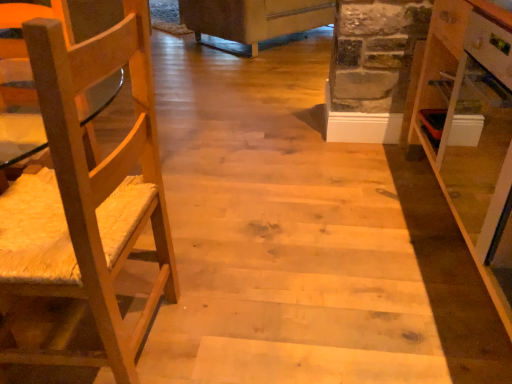
Where is `natural wood chair at left`? The width and height of the screenshot is (512, 384). natural wood chair at left is located at coordinates (89, 195).

Locate an element on the screen. white fabric couch at upper center is located at coordinates (254, 18).

Is white fabric couch at upper center to the left or to the right of natural wood chair at left in the image?

From the image, it's evident that white fabric couch at upper center is to the right of natural wood chair at left.

Is white fabric couch at upper center aimed at natural wood chair at left?

No, white fabric couch at upper center does not turn towards natural wood chair at left.

Can natural wood chair at left be found inside white fabric couch at upper center?

Definitely not — natural wood chair at left is not inside white fabric couch at upper center.

From a real-world perspective, is white fabric couch at upper center physically located above or below white glossy cabinet at right?

From a real-world perspective, white fabric couch at upper center is physically below white glossy cabinet at right.

Where is `furniture beneath the white glossy cabinet at right (from a real-world perspective)`? The image size is (512, 384). furniture beneath the white glossy cabinet at right (from a real-world perspective) is located at coordinates (254, 18).

Is point (300, 23) positioned after point (500, 33)?

Yes, point (300, 23) is farther from viewer.

Considering the sizes of objects natural wood chair at left and white glossy cabinet at right in the image provided, who is wider, natural wood chair at left or white glossy cabinet at right?

natural wood chair at left.

Consider the image. From a real-world perspective, is natural wood chair at left positioned above or below white glossy cabinet at right?

From a real-world perspective, natural wood chair at left is physically below white glossy cabinet at right.

From the image's perspective, is natural wood chair at left positioned above or below white glossy cabinet at right?

From the image's perspective, natural wood chair at left appears below white glossy cabinet at right.

Is natural wood chair at left placed right next to white glossy cabinet at right?

No, natural wood chair at left is not making contact with white glossy cabinet at right.

Is white fabric couch at upper center inside white glossy cabinet at right?

That's incorrect, white fabric couch at upper center is not inside white glossy cabinet at right.

Considering the relative sizes of white glossy cabinet at right and white fabric couch at upper center in the image provided, is white glossy cabinet at right shorter than white fabric couch at upper center?

No, white glossy cabinet at right is not shorter than white fabric couch at upper center.

From the image's perspective, is white glossy cabinet at right above or below white fabric couch at upper center?

white glossy cabinet at right is situated lower than white fabric couch at upper center in the image.

Considering the positions of points (433, 54) and (266, 26), is point (433, 54) closer to camera compared to point (266, 26)?

Yes, point (433, 54) is closer to viewer.

Are white glossy cabinet at right and natural wood chair at left far apart?

white glossy cabinet at right is positioned a significant distance from natural wood chair at left.

Considering the sizes of objects white glossy cabinet at right and natural wood chair at left in the image provided, who is bigger, white glossy cabinet at right or natural wood chair at left?

natural wood chair at left is bigger.

Where is `chair on the left of white glossy cabinet at right`? chair on the left of white glossy cabinet at right is located at coordinates [89, 195].

Could you tell me if white glossy cabinet at right is turned towards natural wood chair at left?

Yes, white glossy cabinet at right is oriented towards natural wood chair at left.

Is natural wood chair at left in contact with white fabric couch at upper center?

natural wood chair at left is not next to white fabric couch at upper center, and they're not touching.

How distant is natural wood chair at left from white fabric couch at upper center?

natural wood chair at left is 3.06 meters from white fabric couch at upper center.

Is point (39, 37) farther from camera compared to point (291, 16)?

No, (39, 37) is in front of (291, 16).

Is natural wood chair at left not within white fabric couch at upper center?

Yes.

Image resolution: width=512 pixels, height=384 pixels. Identify the location of furniture above the natural wood chair at left (from the image's perspective). (254, 18).

At what (x,y) coordinates should I click in order to perform the action: click on furniture located on the left of white glossy cabinet at right. Please return your answer as a coordinate pair (x, y). This screenshot has height=384, width=512. Looking at the image, I should click on [x=254, y=18].

Estimate the real-world distances between objects in this image. Which object is closer to natural wood chair at left, white glossy cabinet at right or white fabric couch at upper center?

Among the two, white glossy cabinet at right is located nearer to natural wood chair at left.

Which object lies further to the anchor point white glossy cabinet at right, white fabric couch at upper center or natural wood chair at left?

The object further to white glossy cabinet at right is white fabric couch at upper center.

From the picture: Estimate the real-world distances between objects in this image. Which object is closer to white fabric couch at upper center, white glossy cabinet at right or natural wood chair at left?

white glossy cabinet at right is closer to white fabric couch at upper center.

From the image, which object appears to be farther from white glossy cabinet at right, natural wood chair at left or white fabric couch at upper center?

white fabric couch at upper center is further to white glossy cabinet at right.

From the image, which object appears to be nearer to natural wood chair at left, white fabric couch at upper center or white glossy cabinet at right?

white glossy cabinet at right is positioned closer to the anchor natural wood chair at left.

From the image, which object appears to be farther from white fabric couch at upper center, natural wood chair at left or white glossy cabinet at right?

natural wood chair at left.

I want to click on cabinetry between natural wood chair at left and white fabric couch at upper center in the front-back direction, so click(471, 121).